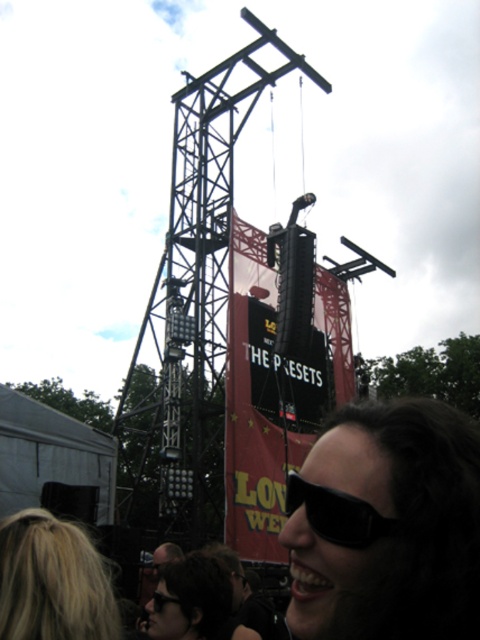
You are a stagehand at the concert venue. You need to move a 120 feet long extension cord from the black matte scoreboard at center to the black plastic goggles at lower center. Is the cord long enough to reach between them?

The black matte scoreboard at center and black plastic goggles at lower center are 127.87 feet apart. The extension cord is only 120 feet long, so it is not long enough to reach between them.

You are standing at the concert and see two points in the image. The first point is at coordinates point (61,616) and the second is at point (300,497). Which point is nearer to you?

Point (61,616) is closer to the camera than point (300,497), so the first point is nearer to you.